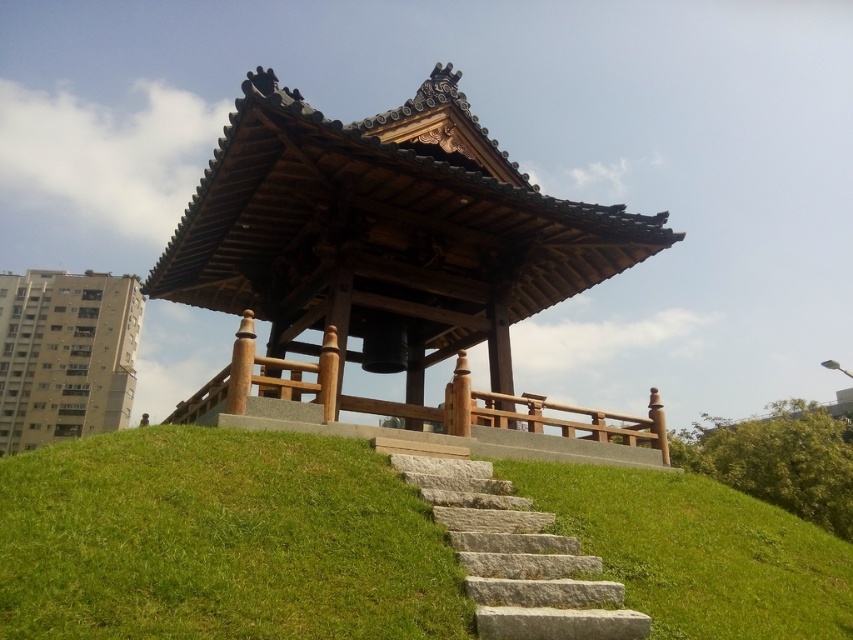
Based on the photo, you are planning to walk up the stairs to the pavilion. There are two sets of stairs available, the green stone stairs at center and the gray stone stairs at center. Which set of stairs is wider?

The green stone stairs at center is wider than the gray stone stairs at center according to the description.

You are planning to place a new decorative statue in the scene. The statue is 2 meters wide. You want to place it near the wooden gazebo at center and the green stone stairs at center. Based on their sizes, which object can accommodate the statue better?

The wooden gazebo at center is bigger than the green stone stairs at center, so it can accommodate the statue better.